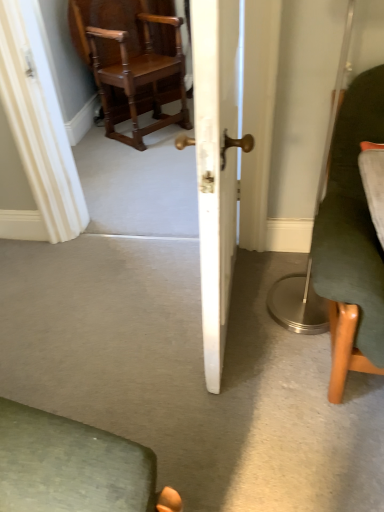
In order to click on vacant space in front of polished wood chair at upper left, arranged as the 2th chair when ordered from the bottom in this screenshot , I will do `click(134, 162)`.